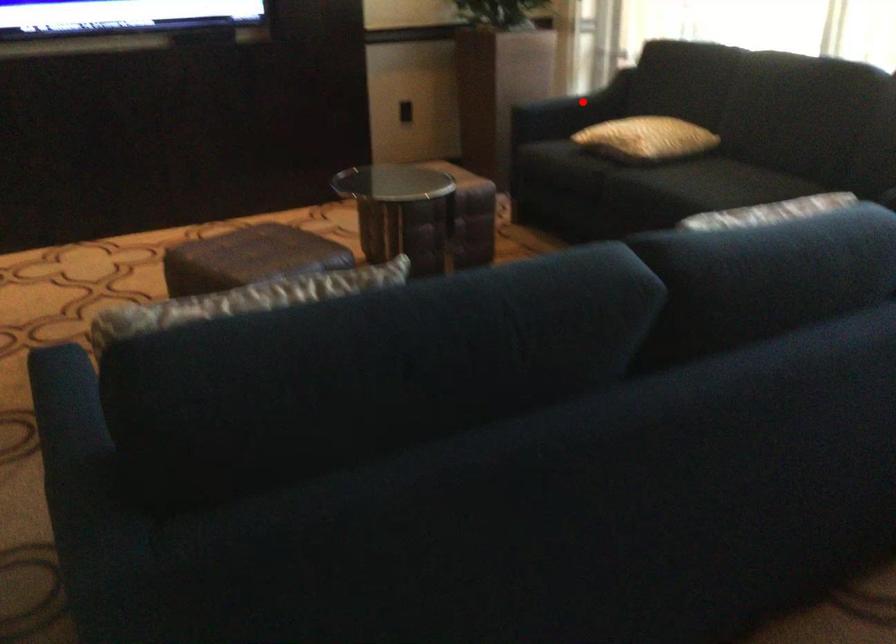
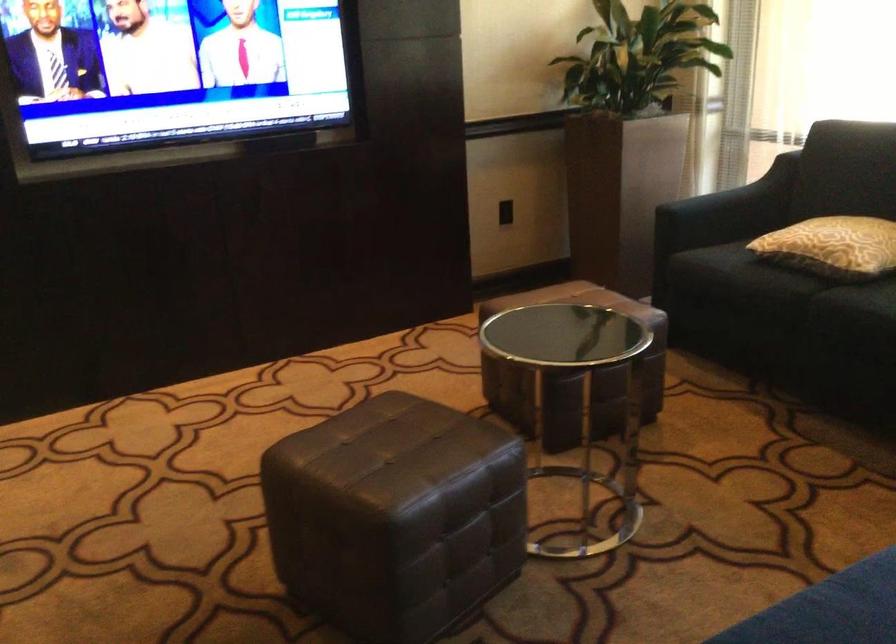
Where in the second image is the point corresponding to the highlighted location from the first image?

(742, 196)